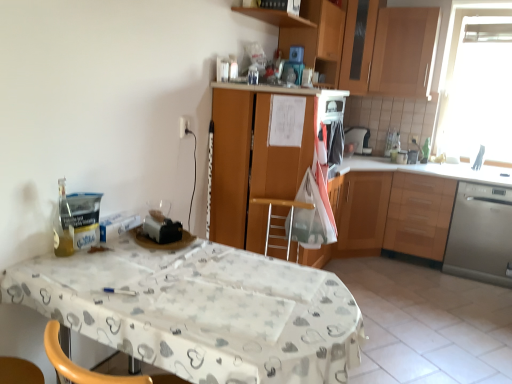
Measure the distance between transparent glass window at upper right and camera.

The depth of transparent glass window at upper right is 11.83 feet.

Locate an element on the screen. Image resolution: width=512 pixels, height=384 pixels. wooden cabinet at right, the 4th cabinetry from the left is located at coordinates (394, 214).

What are the coordinates of `transparent glass window at upper right` in the screenshot? It's located at coord(456,67).

How far apart are wooden cabinet at right, the 4th cabinetry from the left, and wooden cabinet at upper center, acting as the 3th cabinetry starting from the right?

A distance of 1.21 meters exists between wooden cabinet at right, the 4th cabinetry from the left, and wooden cabinet at upper center, acting as the 3th cabinetry starting from the right.

In the image, is wooden cabinet at right, which is the first cabinetry in right-to-left order, on the left side or the right side of wooden cabinet at upper center, acting as the 3th cabinetry starting from the right?

In the image, wooden cabinet at right, which is the first cabinetry in right-to-left order, appears on the right side of wooden cabinet at upper center, acting as the 3th cabinetry starting from the right.

I want to click on the 2nd cabinetry located above the wooden cabinet at right, which is the first cabinetry in right-to-left order (from a real-world perspective), so click(317, 38).

Does point (338, 247) appear closer or farther from the camera than point (318, 22)?

Point (338, 247) appears to be farther away from the viewer than point (318, 22).

Between transparent glass window at upper right and wooden cabinet at upper center, acting as the 3th cabinetry starting from the right, which one has more height?

transparent glass window at upper right is taller.

Which is closer to the camera, (444, 80) or (308, 41)?

Point (444, 80) is positioned farther from the camera compared to point (308, 41).

Is the position of transparent glass window at upper right more distant than that of wooden cabinet at upper center, marked as the 2th cabinetry in a left-to-right arrangement?

Yes, transparent glass window at upper right is behind wooden cabinet at upper center, marked as the 2th cabinetry in a left-to-right arrangement.

From the picture: Considering the relative sizes of transparent glass window at upper right and wooden cabinet at upper center, marked as the 2th cabinetry in a left-to-right arrangement, in the image provided, is transparent glass window at upper right smaller than wooden cabinet at upper center, marked as the 2th cabinetry in a left-to-right arrangement,?

No.

Can you tell me how much white glossy tile at lower right and wooden cabinet at upper center, acting as the 3th cabinetry starting from the right, differ in facing direction?

The angle between the facing direction of white glossy tile at lower right and the facing direction of wooden cabinet at upper center, acting as the 3th cabinetry starting from the right, is 0.0792 degrees.

Do you think white glossy tile at lower right is within wooden cabinet at upper center, acting as the 3th cabinetry starting from the right, or outside of it?

white glossy tile at lower right is spatially situated outside wooden cabinet at upper center, acting as the 3th cabinetry starting from the right.

Is white glossy tile at lower right oriented towards wooden cabinet at upper center, acting as the 3th cabinetry starting from the right?

No, white glossy tile at lower right is not turned towards wooden cabinet at upper center, acting as the 3th cabinetry starting from the right.

Would you say white glossy tile at lower right is part of white glossy sink at upper right's contents?

No, white glossy tile at lower right is not inside white glossy sink at upper right.

Is white glossy sink at upper right further to the viewer compared to white glossy tile at lower right?

Yes, it is.

Considering the sizes of white glossy sink at upper right and white glossy tile at lower right in the image, is white glossy sink at upper right taller or shorter than white glossy tile at lower right?

Clearly, white glossy sink at upper right is taller compared to white glossy tile at lower right.

Is satin silver dishwasher at right not near wooden cabinet at center, which ranks as the fourth cabinetry in right-to-left order?

Yes, satin silver dishwasher at right is far from wooden cabinet at center, which ranks as the fourth cabinetry in right-to-left order.

From the image's perspective, is satin silver dishwasher at right positioned above or below wooden cabinet at center, which is counted as the first cabinetry, starting from the left?

Clearly, from the image's perspective, satin silver dishwasher at right is below wooden cabinet at center, which is counted as the first cabinetry, starting from the left.

Does satin silver dishwasher at right come behind wooden cabinet at center, which ranks as the fourth cabinetry in right-to-left order?

Yes, it is behind wooden cabinet at center, which ranks as the fourth cabinetry in right-to-left order.

Can you confirm if satin silver dishwasher at right is thinner than wooden cabinet at center, which ranks as the fourth cabinetry in right-to-left order?

In fact, satin silver dishwasher at right might be wider than wooden cabinet at center, which ranks as the fourth cabinetry in right-to-left order.

Which point is more distant from viewer, (375,44) or (351,232)?

The point (375,44) is farther.

Is wooden cabinet at upper right, which is the 2th cabinetry from right to left, not close to wooden cabinet at right, the 4th cabinetry from the left?

Indeed, wooden cabinet at upper right, which is the 2th cabinetry from right to left, is not near wooden cabinet at right, the 4th cabinetry from the left.

From a real-world perspective, is wooden cabinet at upper right, the 3th cabinetry positioned from the left, physically below wooden cabinet at right, which is the first cabinetry in right-to-left order?

No, from a real-world perspective, wooden cabinet at upper right, the 3th cabinetry positioned from the left, is not below wooden cabinet at right, which is the first cabinetry in right-to-left order.

This screenshot has height=384, width=512. I want to click on cabinetry that is the 3rd one when counting upward from the wooden cabinet at right, which is the first cabinetry in right-to-left order (from the image's perspective), so click(x=404, y=52).

Consider the image. Considering the sizes of objects satin silver dishwasher at right and wooden cabinet at upper center, acting as the 3th cabinetry starting from the right, in the image provided, who is thinner, satin silver dishwasher at right or wooden cabinet at upper center, acting as the 3th cabinetry starting from the right,?

With smaller width is wooden cabinet at upper center, acting as the 3th cabinetry starting from the right.

Which point is more distant from viewer, (478, 221) or (313, 9)?

Positioned behind is point (478, 221).

Considering the relative sizes of satin silver dishwasher at right and wooden cabinet at upper center, marked as the 2th cabinetry in a left-to-right arrangement, in the image provided, is satin silver dishwasher at right shorter than wooden cabinet at upper center, marked as the 2th cabinetry in a left-to-right arrangement,?

In fact, satin silver dishwasher at right may be taller than wooden cabinet at upper center, marked as the 2th cabinetry in a left-to-right arrangement.

From the wooden cabinet at right, which is the first cabinetry in right-to-left order, count the 2nd cabinetry to the left and point to it. Please provide its 2D coordinates.

[(317, 38)]

The image size is (512, 384). I want to click on window on the right of wooden cabinet at upper center, acting as the 3th cabinetry starting from the right, so click(x=456, y=67).

Considering their positions, is wooden cabinet at center, which is counted as the first cabinetry, starting from the left, positioned further to wooden shelf at upper center than white glossy sink at upper right?

white glossy sink at upper right is positioned further to the anchor wooden shelf at upper center.

From the image, which object appears to be nearer to white fabric-covered table at center, white glossy tile at lower right or wooden cabinet at right, the 4th cabinetry from the left?

white glossy tile at lower right is closer to white fabric-covered table at center.

Based on their spatial positions, is white glossy tile at lower right or white glossy sink at upper right further from wooden cabinet at upper right, which is the 2th cabinetry from right to left?

Among the two, white glossy tile at lower right is located further to wooden cabinet at upper right, which is the 2th cabinetry from right to left.

Based on their spatial positions, is wooden cabinet at upper right, which is the 2th cabinetry from right to left, or wooden cabinet at upper center, acting as the 3th cabinetry starting from the right, closer to wooden cabinet at center, which ranks as the fourth cabinetry in right-to-left order?

wooden cabinet at upper center, acting as the 3th cabinetry starting from the right, lies closer to wooden cabinet at center, which ranks as the fourth cabinetry in right-to-left order, than the other object.

Estimate the real-world distances between objects in this image. Which object is further from white glossy sink at upper right, wooden cabinet at center, which ranks as the fourth cabinetry in right-to-left order, or wooden cabinet at right, the 4th cabinetry from the left?

wooden cabinet at center, which ranks as the fourth cabinetry in right-to-left order, is further to white glossy sink at upper right.

Which object lies nearer to the anchor point wooden cabinet at upper center, acting as the 3th cabinetry starting from the right, satin silver dishwasher at right or white glossy tile at lower right?

satin silver dishwasher at right.

Estimate the real-world distances between objects in this image. Which object is further from wooden cabinet at upper center, marked as the 2th cabinetry in a left-to-right arrangement, transparent glass window at upper right or white glossy sink at upper right?

transparent glass window at upper right is positioned further to the anchor wooden cabinet at upper center, marked as the 2th cabinetry in a left-to-right arrangement.

From the picture: Considering their positions, is white glossy sink at upper right positioned further to wooden cabinet at upper right, which is the 2th cabinetry from right to left, than wooden shelf at upper center?

wooden shelf at upper center is positioned further to the anchor wooden cabinet at upper right, which is the 2th cabinetry from right to left.

Where is `dish washer positioned between white fabric-covered table at center and wooden cabinet at right, the 4th cabinetry from the left, from near to far`? dish washer positioned between white fabric-covered table at center and wooden cabinet at right, the 4th cabinetry from the left, from near to far is located at coordinates (481, 234).

You are a GUI agent. You are given a task and a screenshot of the screen. Output one action in this format:
    pyautogui.click(x=<x>, y=<y>)
    Task: Click on the table between wooden shelf at upper center and white glossy tile at lower right from top to bottom
    
    Given the screenshot: What is the action you would take?
    click(x=201, y=311)

You are a GUI agent. You are given a task and a screenshot of the screen. Output one action in this format:
    pyautogui.click(x=<x>, y=<y>)
    Task: Click on the tile between wooden cabinet at center, which is counted as the first cabinetry, starting from the left, and satin silver dishwasher at right from left to right
    This screenshot has width=512, height=384.
    Given the screenshot: What is the action you would take?
    pyautogui.click(x=426, y=324)

Identify the location of shelf between white fabric-covered table at center and satin silver dishwasher at right. This screenshot has width=512, height=384. [275, 17].